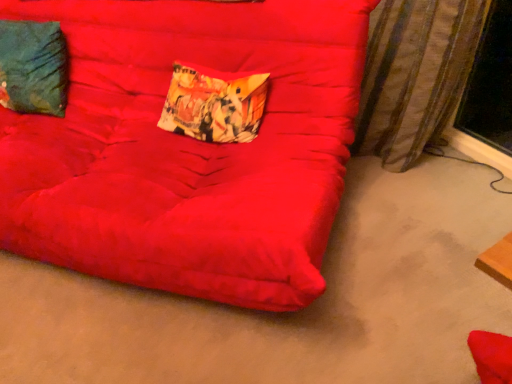
This screenshot has width=512, height=384. Find the location of `vacant area located to the right-hand side of striped fabric curtain at right`. vacant area located to the right-hand side of striped fabric curtain at right is located at coordinates tap(472, 165).